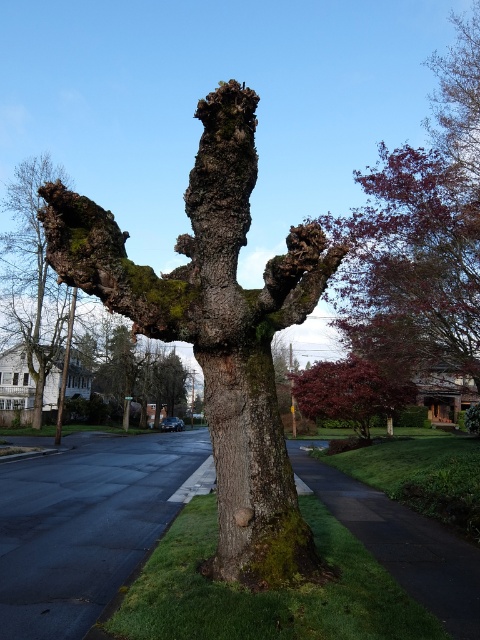
You are a gardener examining the green mossy tree trunk at center and the green mossy bark at center. Which part of the tree is higher up?

The green mossy tree trunk at center is located above the green mossy bark at center, so the trunk is higher up than the bark.

You are standing in front of the tree and want to touch both the green mossy tree trunk at center and the green mossy bark at left. Which part should you reach for first to touch the closer one?

The green mossy tree trunk at center is closer to the viewer than the green mossy bark at left, so you should reach for the green mossy tree trunk at center first.